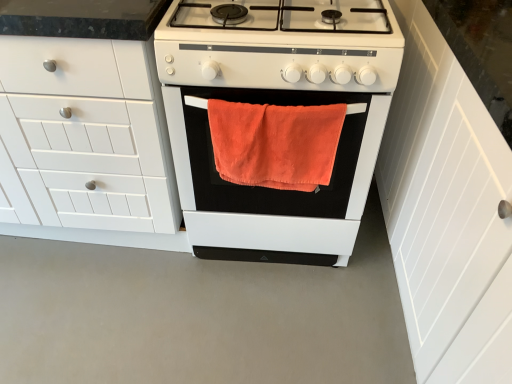
Question: Is white matte gas stove at center with white matte cabinet at left, arranged as the first cabinetry when viewed from the left?

Choices:
 (A) yes
 (B) no

Answer: (B)

Question: From a real-world perspective, is white matte gas stove at center physically below white matte cabinet at left, arranged as the first cabinetry when viewed from the left?

Choices:
 (A) no
 (B) yes

Answer: (A)

Question: Can you confirm if white matte gas stove at center is thinner than white matte cabinet at left, arranged as the first cabinetry when viewed from the left?

Choices:
 (A) yes
 (B) no

Answer: (B)

Question: Does white matte gas stove at center appear on the left side of white matte cabinet at left, arranged as the first cabinetry when viewed from the left?

Choices:
 (A) yes
 (B) no

Answer: (B)

Question: Are white matte gas stove at center and white matte cabinet at left, acting as the 2th cabinetry starting from the right, far apart?

Choices:
 (A) no
 (B) yes

Answer: (A)

Question: Can you confirm if white matte gas stove at center is bigger than white matte cabinet at left, acting as the 2th cabinetry starting from the right?

Choices:
 (A) no
 (B) yes

Answer: (A)

Question: Considering the relative sizes of white wood cabinet at right, which is counted as the first cabinetry, starting from the right, and white matte oven at center in the image provided, is white wood cabinet at right, which is counted as the first cabinetry, starting from the right, shorter than white matte oven at center?

Choices:
 (A) yes
 (B) no

Answer: (B)

Question: Is white matte oven at center a part of white wood cabinet at right, marked as the 2th cabinetry in a left-to-right arrangement?

Choices:
 (A) no
 (B) yes

Answer: (A)

Question: Is white wood cabinet at right, marked as the 2th cabinetry in a left-to-right arrangement, closer to the viewer compared to white matte oven at center?

Choices:
 (A) no
 (B) yes

Answer: (B)

Question: Is white wood cabinet at right, marked as the 2th cabinetry in a left-to-right arrangement, taller than white matte oven at center?

Choices:
 (A) yes
 (B) no

Answer: (A)

Question: Considering the relative sizes of white wood cabinet at right, marked as the 2th cabinetry in a left-to-right arrangement, and white matte oven at center in the image provided, is white wood cabinet at right, marked as the 2th cabinetry in a left-to-right arrangement, wider than white matte oven at center?

Choices:
 (A) no
 (B) yes

Answer: (A)

Question: Are white wood cabinet at right, marked as the 2th cabinetry in a left-to-right arrangement, and white matte oven at center located far from each other?

Choices:
 (A) no
 (B) yes

Answer: (A)

Question: Could you tell me if white matte cabinet at left, acting as the 2th cabinetry starting from the right, is turned towards white matte oven at center?

Choices:
 (A) yes
 (B) no

Answer: (B)